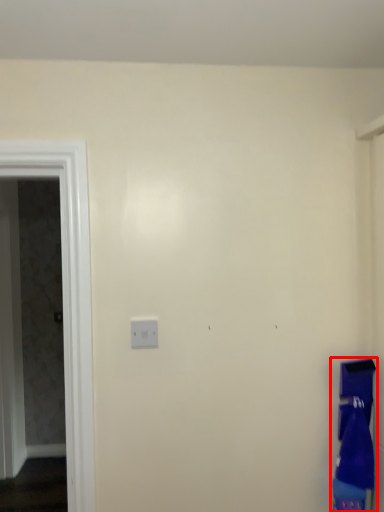
Question: From the image's perspective, where is laundry (annotated by the red box) located in relation to screen door in the image?

Choices:
 (A) below
 (B) above

Answer: (A)